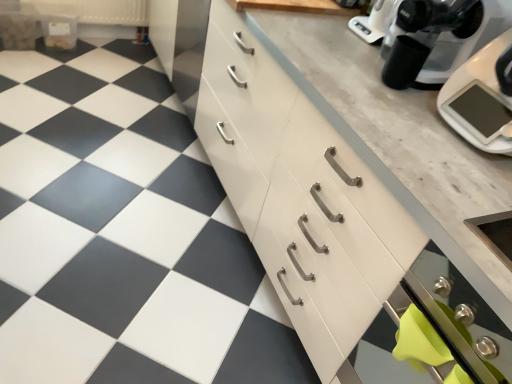
I want to click on vacant area that is in front of white glossy kitchen scale at upper right, so click(x=461, y=175).